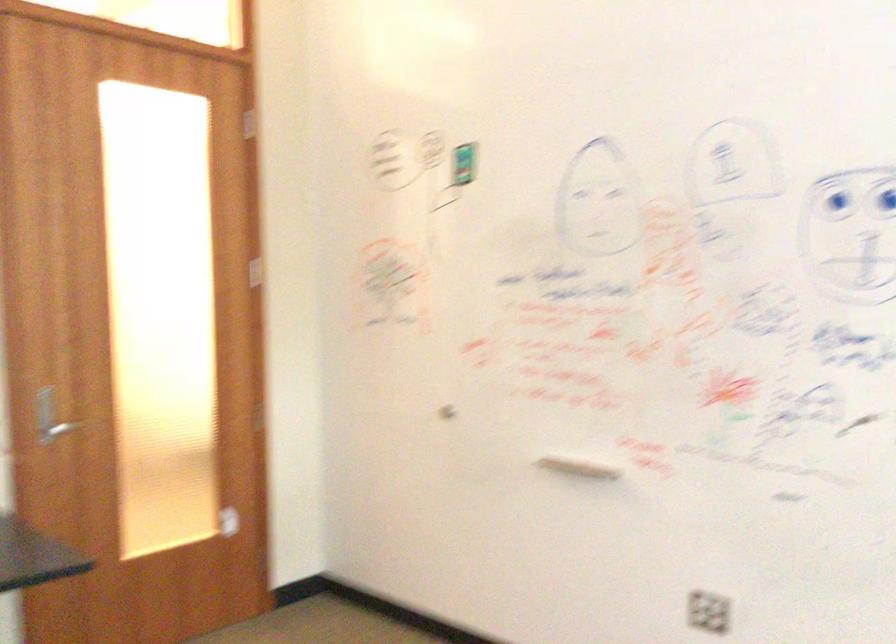
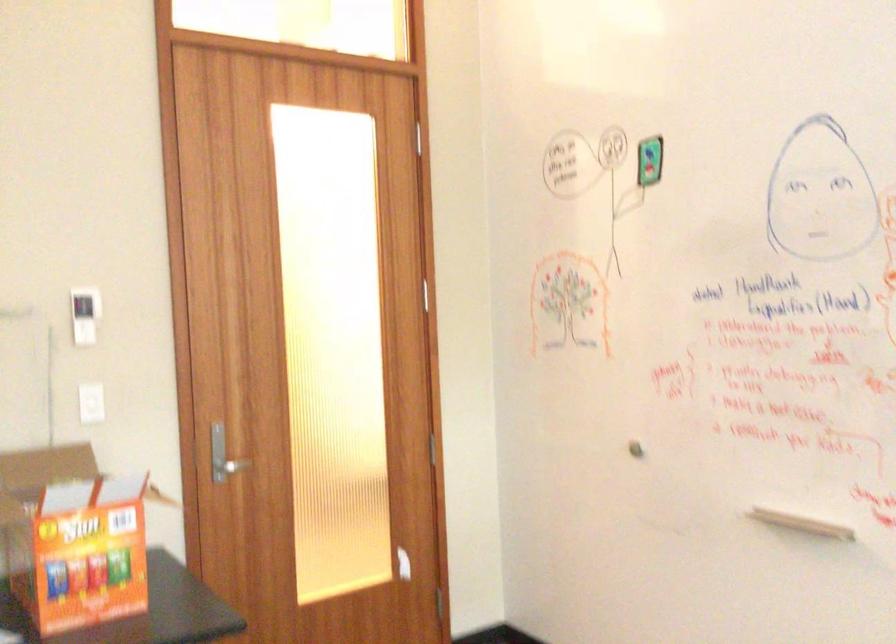
Question: In a continuous first-person perspective shot, in which direction is the camera moving?

Choices:
 (A) Left
 (B) Right
 (C) Forward
 (D) Backward

Answer: (C)